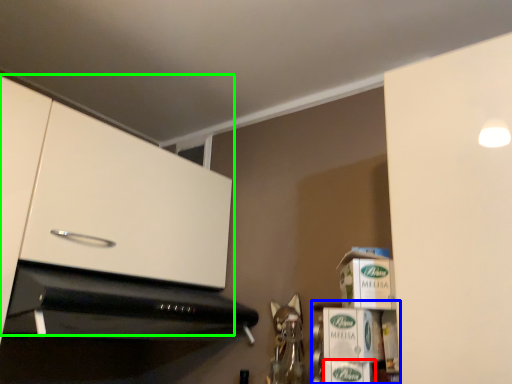
Question: Based on their relative distances, which object is farther from cardboard box (highlighted by a red box)? Choose from shelf (highlighted by a blue box) and cabinetry (highlighted by a green box).

Choices:
 (A) shelf
 (B) cabinetry

Answer: (B)